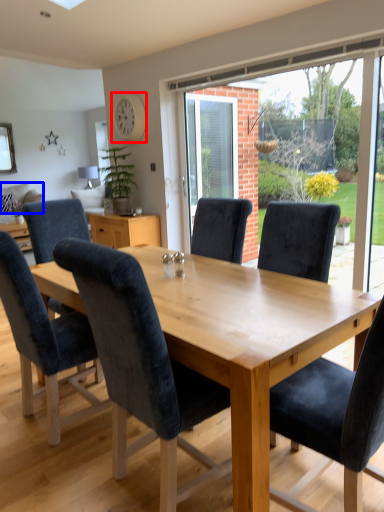
Question: Which point is further to the camera, clock (highlighted by a red box) or pillow (highlighted by a blue box)?

Choices:
 (A) clock
 (B) pillow

Answer: (B)